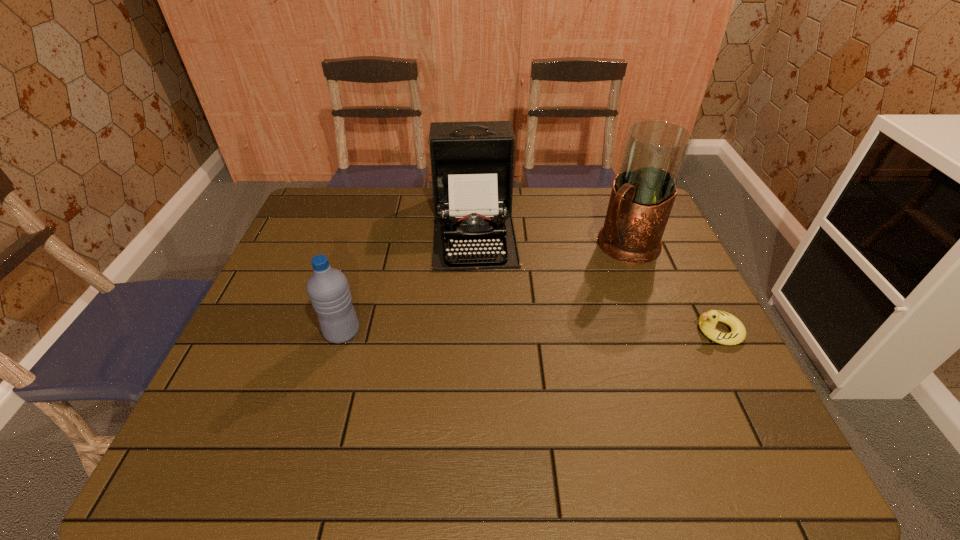
The image size is (960, 540). Identify the location of object that is at the far right corner. 643,193.

Identify the location of vacant space at the far edge of the desktop. (406, 218).

At what (x,y) coordinates should I click in order to perform the action: click on free point at the near edge. Please return your answer as a coordinate pair (x, y). The width and height of the screenshot is (960, 540). Looking at the image, I should click on (572, 388).

In the image, there is a desktop. What are the coordinates of `vacant space at the left edge` in the screenshot? It's located at (293, 249).

In the image, there is a desktop. Identify the location of vacant space at the right edge. This screenshot has width=960, height=540. (672, 313).

This screenshot has height=540, width=960. I want to click on unoccupied position between the pitcher and the water bottle, so click(x=484, y=289).

Where is `vacant space in between the tallest object and the second object from left to right`? vacant space in between the tallest object and the second object from left to right is located at coordinates (550, 237).

Where is `vacant space that's between the leftmost object and the duckling`? The height and width of the screenshot is (540, 960). vacant space that's between the leftmost object and the duckling is located at coordinates (530, 332).

In order to click on vacant space that is in between the second shortest object and the third shortest object in this screenshot , I will do `click(408, 280)`.

This screenshot has height=540, width=960. What are the coordinates of `vacant point located between the typewriter and the pitcher` in the screenshot? It's located at (550, 237).